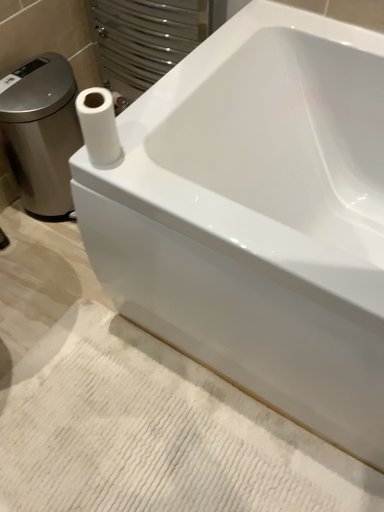
Question: From a real-world perspective, does white textured bath mat at lower center sit lower than white glossy porcelain at left?

Choices:
 (A) yes
 (B) no

Answer: (A)

Question: Is white textured bath mat at lower center smaller than white glossy porcelain at left?

Choices:
 (A) no
 (B) yes

Answer: (B)

Question: Is white textured bath mat at lower center wider than white glossy porcelain at left?

Choices:
 (A) no
 (B) yes

Answer: (B)

Question: Could white glossy porcelain at left be considered to be inside white textured bath mat at lower center?

Choices:
 (A) yes
 (B) no

Answer: (B)

Question: Does white textured bath mat at lower center have a lesser width compared to white glossy porcelain at left?

Choices:
 (A) no
 (B) yes

Answer: (A)

Question: From a real-world perspective, does white textured bath mat at lower center stand above white glossy porcelain at left?

Choices:
 (A) no
 (B) yes

Answer: (A)

Question: Considering the relative sizes of white matte paper towel at upper left and white glossy porcelain at left in the image provided, is white matte paper towel at upper left smaller than white glossy porcelain at left?

Choices:
 (A) yes
 (B) no

Answer: (A)

Question: Considering the relative sizes of white matte paper towel at upper left and white glossy porcelain at left in the image provided, is white matte paper towel at upper left taller than white glossy porcelain at left?

Choices:
 (A) yes
 (B) no

Answer: (B)

Question: Is white glossy porcelain at left a part of white matte paper towel at upper left?

Choices:
 (A) no
 (B) yes

Answer: (A)

Question: Is white matte paper towel at upper left not within white glossy porcelain at left?

Choices:
 (A) yes
 (B) no

Answer: (A)

Question: Is white matte paper towel at upper left to the left of white glossy porcelain at left from the viewer's perspective?

Choices:
 (A) yes
 (B) no

Answer: (B)

Question: Does white matte paper towel at upper left come behind white glossy porcelain at left?

Choices:
 (A) yes
 (B) no

Answer: (B)

Question: From the image's perspective, is white glossy porcelain at left below white matte paper towel at upper left?

Choices:
 (A) no
 (B) yes

Answer: (A)